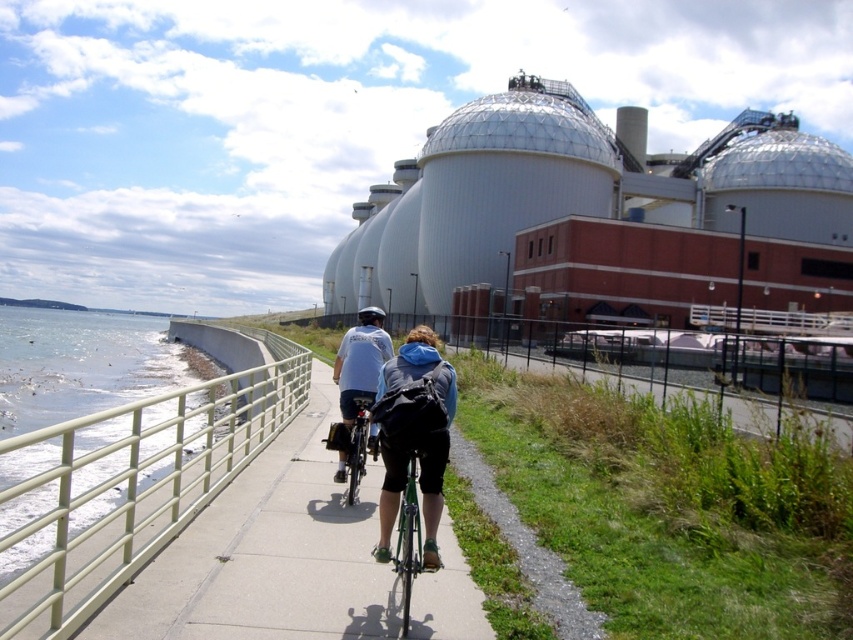
Question: Which point is farther to the camera?

Choices:
 (A) green matte bicycle at center
 (B) green matte railing at lower left
 (C) white matte shirt at center
 (D) dark blue fabric jacket at center

Answer: (C)

Question: Observing the image, what is the correct spatial positioning of white matte shirt at center in reference to green metallic bicycle at center?

Choices:
 (A) left
 (B) right

Answer: (A)

Question: Can you confirm if green metallic bicycle at center is bigger than green matte bicycle at center?

Choices:
 (A) yes
 (B) no

Answer: (B)

Question: Is dark blue fabric jacket at center above green matte bicycle at center?

Choices:
 (A) yes
 (B) no

Answer: (A)

Question: Among these objects, which one is farthest from the camera?

Choices:
 (A) green matte bicycle at center
 (B) dark blue fabric jacket at center
 (C) white matte shirt at center
 (D) green metallic bicycle at center

Answer: (C)

Question: Which of the following is the farthest from the observer?

Choices:
 (A) white matte shirt at center
 (B) green matte railing at lower left
 (C) dark blue fabric jacket at center
 (D) green matte bicycle at center

Answer: (A)